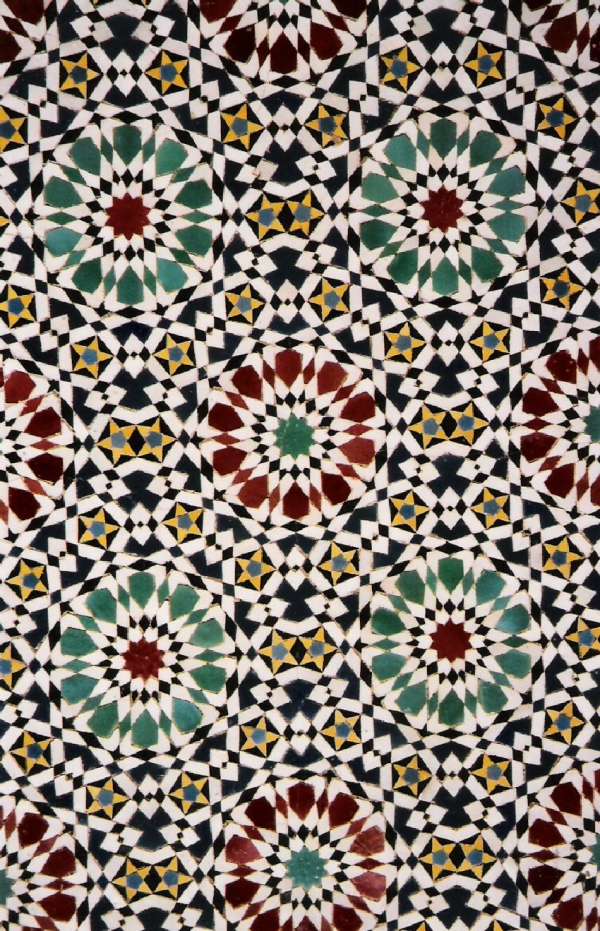
This screenshot has height=931, width=600. In order to click on left flower in this screenshot , I will do `click(132, 220)`, `click(141, 652)`.